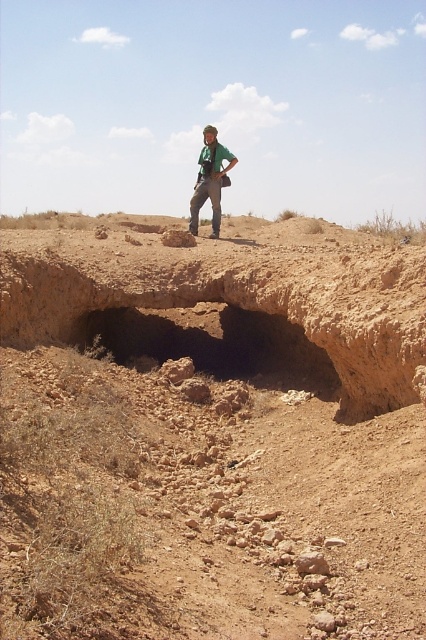
Question: Is dusty soil cave at center wider than green fabric shirt at center?

Choices:
 (A) no
 (B) yes

Answer: (A)

Question: Which is nearer to the dusty brown dirt field at center?

Choices:
 (A) dusty soil cave at center
 (B) green fabric shirt at center

Answer: (A)

Question: Does dusty soil cave at center have a lesser width compared to green fabric shirt at center?

Choices:
 (A) no
 (B) yes

Answer: (B)

Question: Which point is farther to the camera?

Choices:
 (A) (97, 620)
 (B) (293, 362)
 (C) (218, 214)

Answer: (C)

Question: Is dusty brown dirt field at center above dusty soil cave at center?

Choices:
 (A) yes
 (B) no

Answer: (A)

Question: Which is farther from the dusty brown dirt field at center?

Choices:
 (A) dusty soil cave at center
 (B) green fabric shirt at center

Answer: (B)